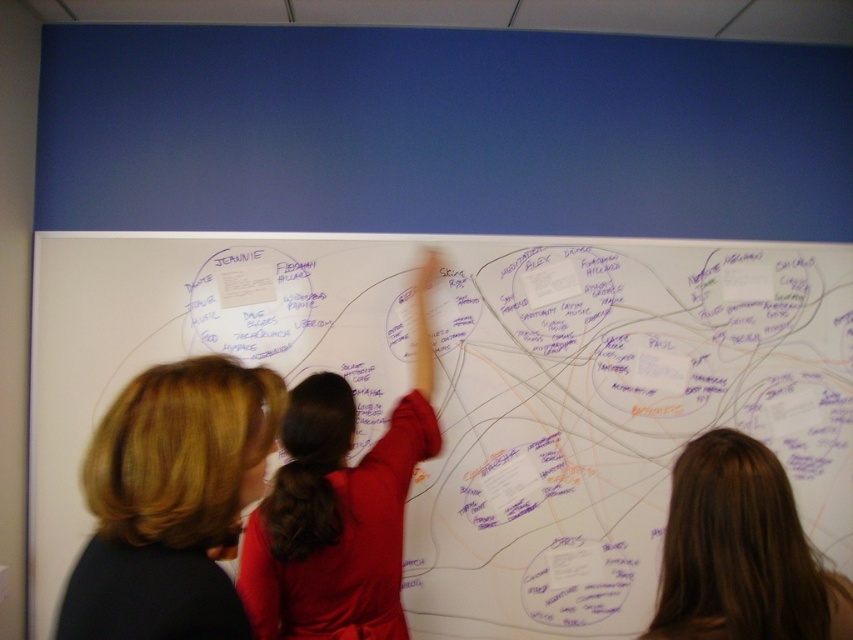
Does white matte whiteboard at center appear on the right side of blonde hair at center?

Indeed, white matte whiteboard at center is positioned on the right side of blonde hair at center.

In order to click on white matte whiteboard at center in this screenshot , I will do `click(613, 419)`.

Who is more forward, (332, 552) or (764, 449)?

Positioned in front is point (764, 449).

Is red fabric shirt at center above brown hair at upper right?

Indeed, red fabric shirt at center is positioned over brown hair at upper right.

Is point (421, 314) more distant than point (759, 474)?

That is True.

Locate an element on the screen. The image size is (853, 640). red fabric shirt at center is located at coordinates (339, 508).

Between blonde hair at center and brown hair at upper right, which one appears on the left side from the viewer's perspective?

Positioned to the left is blonde hair at center.

Who is taller, blonde hair at center or brown hair at upper right?

blonde hair at center

Between point (175, 557) and point (729, 465), which one is positioned behind?

The point (729, 465) is behind.

Where is `blonde hair at center`? blonde hair at center is located at coordinates (171, 500).